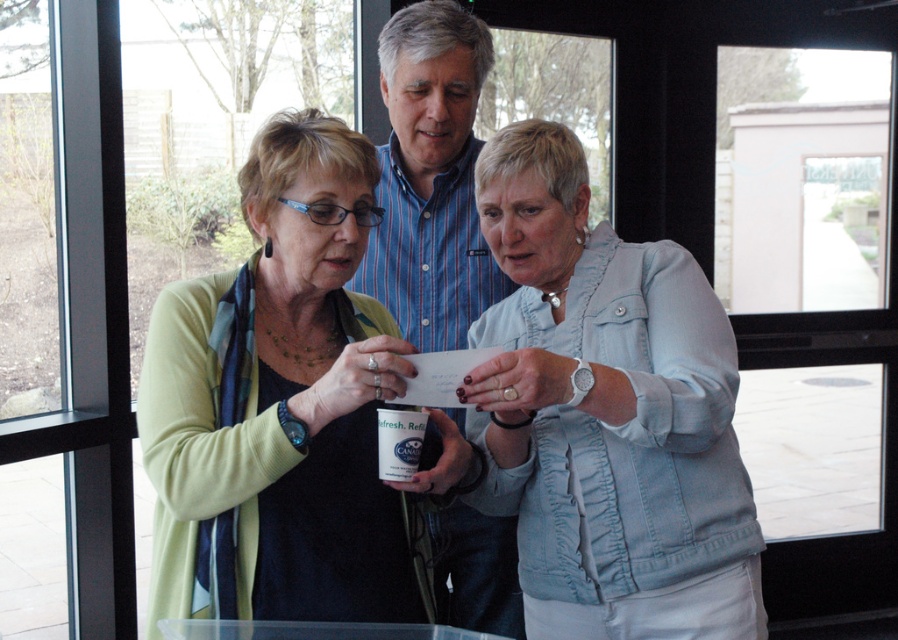
You are a photographer at the event and want to take a photo of the blue striped shirt at center and the white glossy mug at center. Which object should you focus on first if you want to capture both in sharp focus?

The white glossy mug at center is closer to the viewer than the blue striped shirt at center, so you should focus on the white glossy mug at center first to ensure both are in sharp focus.

You are a photographer standing 1 meter away from the light blue denim jacket at center and the blue striped shirt at center. You want to take a photo of both objects in the same frame without moving. Can you fit both in the frame if your camera has a 50 cm wide field of view?

The light blue denim jacket at center is 42.80 centimeters away from the blue striped shirt at center. Since your camera has a 50 cm wide field of view and the distance between them is less than 50 cm, both objects can fit within the frame without moving.